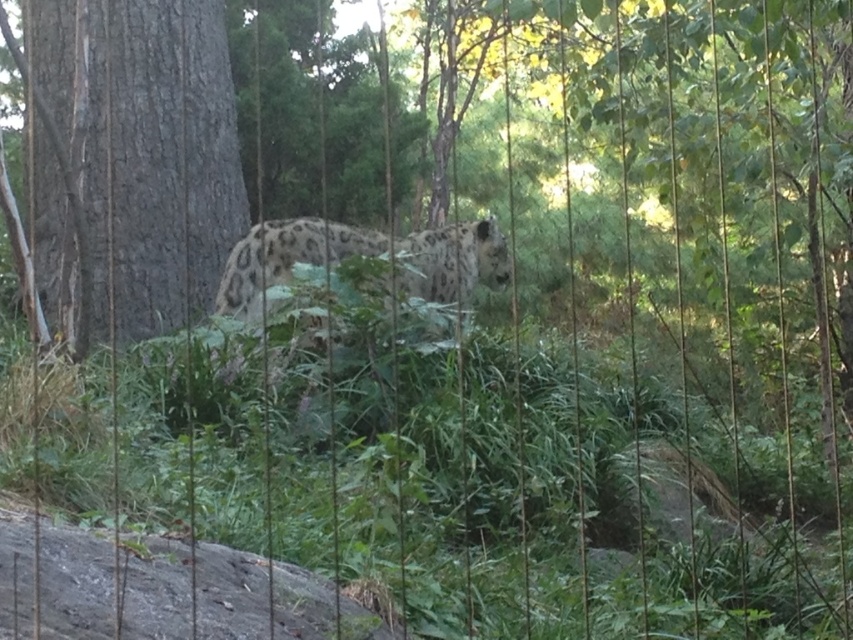
Measure the distance between gray textured bark at left and camera.

They are 18.40 feet apart.

Which is more to the right, gray textured bark at left or spotted fur leopard at center?

spotted fur leopard at center is more to the right.

Where is `gray textured bark at left`? gray textured bark at left is located at coordinates (132, 161).